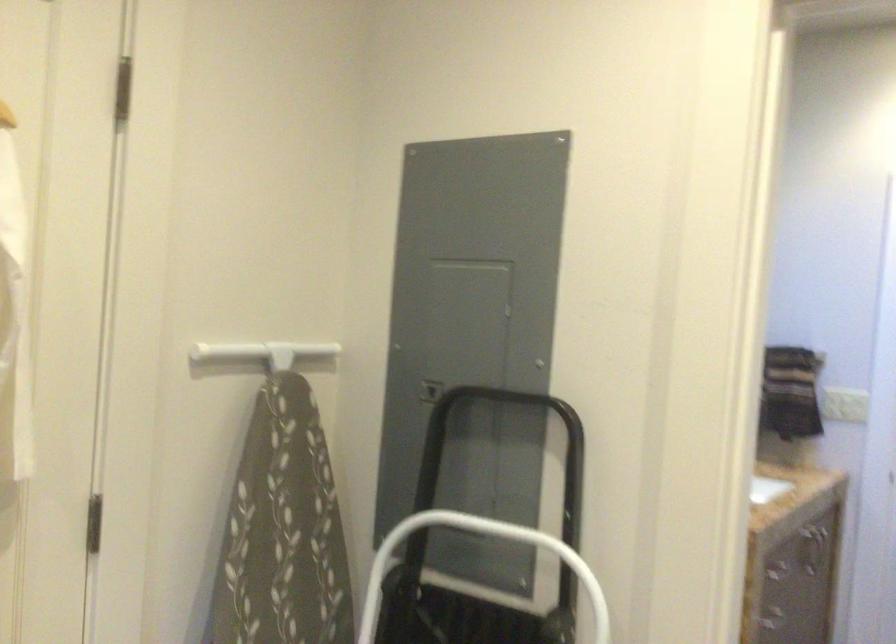
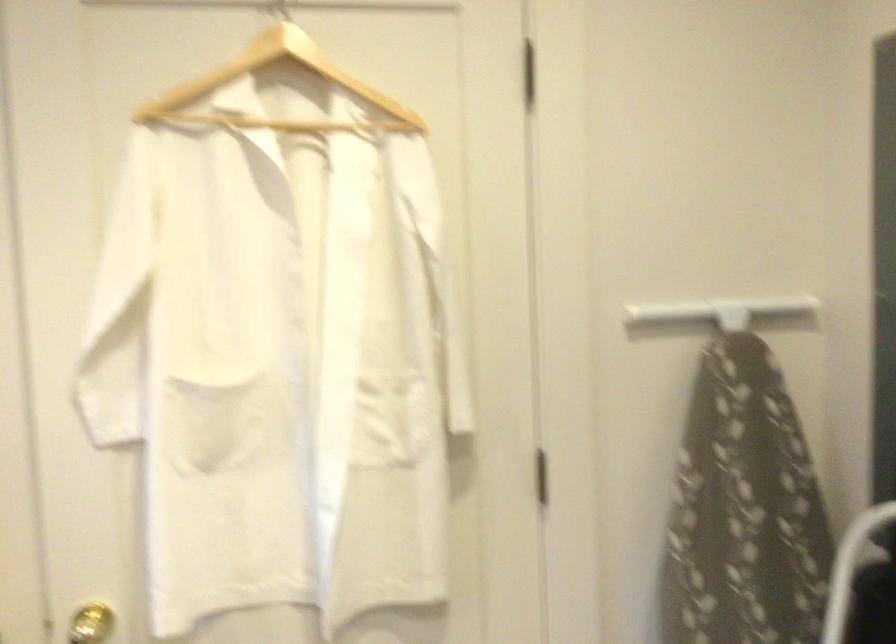
Question: The camera is either moving clockwise (left) or counter-clockwise (right) around the object. The first image is from the beginning of the video and the second image is from the end. Is the camera moving left or right when shooting the video?

Choices:
 (A) Left
 (B) Right

Answer: (B)